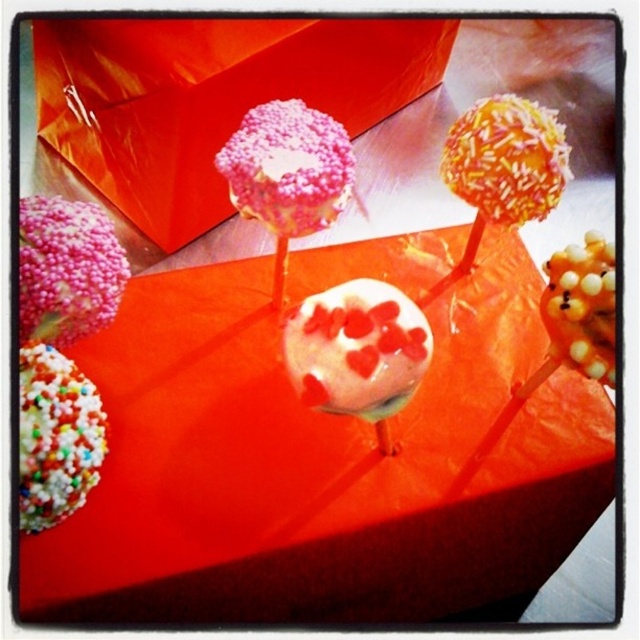
You are standing in front of the vibrant cake pop arrangement on the bright orange surface. You see the pink sprinkled lollipop at upper center. Can you determine its exact position using the coordinate system provided?

The pink sprinkled lollipop at upper center is located at point coordinates (288,168).

Based on the photo, you are a baker who wants to place a new cake pop on the table. You need to place it exactly where the multicolored sprinkles at lower left are located. What are the coordinates of that location?

The coordinates of the location where the multicolored sprinkles at lower left are located are at point (54, 436).